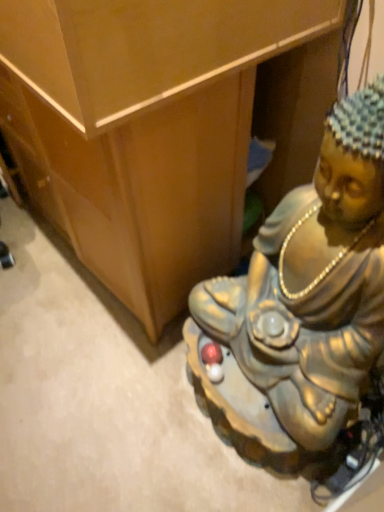
Question: From the image's perspective, is metallic statue at lower right positioned above or below metallic gold statue at lower right?

Choices:
 (A) below
 (B) above

Answer: (B)

Question: Is metallic statue at lower right to the left or to the right of metallic gold statue at lower right in the image?

Choices:
 (A) right
 (B) left

Answer: (B)

Question: Is metallic statue at lower right inside the boundaries of metallic gold statue at lower right, or outside?

Choices:
 (A) outside
 (B) inside

Answer: (A)

Question: Considering the positions of metallic gold statue at lower right and metallic statue at lower right in the image, is metallic gold statue at lower right taller or shorter than metallic statue at lower right?

Choices:
 (A) tall
 (B) short

Answer: (A)

Question: Relative to metallic statue at lower right, is metallic gold statue at lower right in front or behind?

Choices:
 (A) front
 (B) behind

Answer: (A)

Question: Looking at the image, does metallic gold statue at lower right seem bigger or smaller compared to metallic statue at lower right?

Choices:
 (A) small
 (B) big

Answer: (B)

Question: In the image, is metallic gold statue at lower right on the left side or the right side of metallic statue at lower right?

Choices:
 (A) left
 (B) right

Answer: (B)